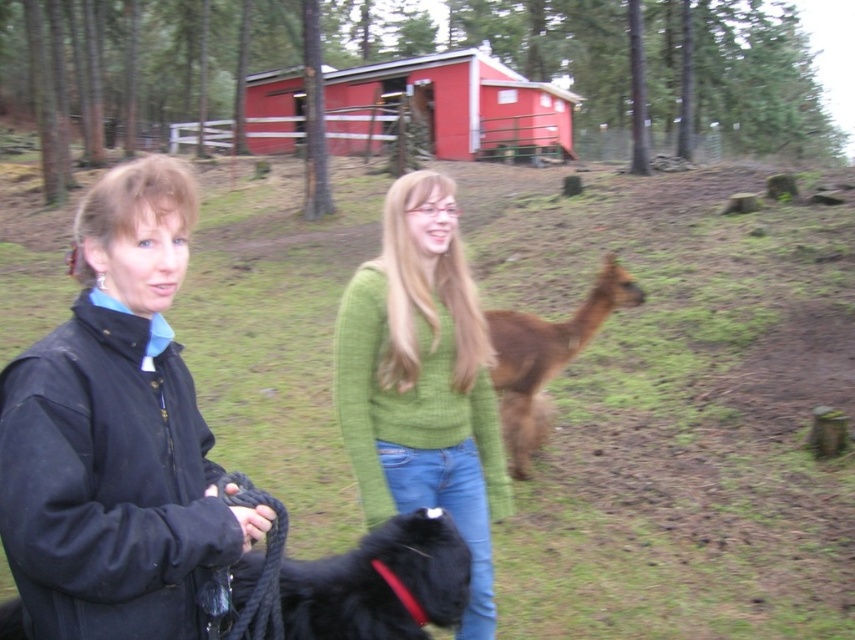
Question: From the image, what is the correct spatial relationship of black fleece jacket at left in relation to red wood cabin at upper center?

Choices:
 (A) above
 (B) below

Answer: (B)

Question: Is black fleece jacket at left wider than green knitted sweater at center?

Choices:
 (A) no
 (B) yes

Answer: (A)

Question: Is black fleece jacket at left in front of green knitted sweater at center?

Choices:
 (A) no
 (B) yes

Answer: (B)

Question: Which object appears farthest from the camera in this image?

Choices:
 (A) black fuzzy dog at lower center
 (B) green knitted sweater at center

Answer: (B)

Question: Which object is closer to the camera taking this photo?

Choices:
 (A) red wood cabin at upper center
 (B) black fuzzy dog at lower center
 (C) black fleece jacket at left
 (D) green knitted sweater at center

Answer: (C)

Question: Which point is farther from the camera taking this photo?

Choices:
 (A) (422, 83)
 (B) (611, 278)
 (C) (388, 515)
 (D) (450, 609)

Answer: (A)